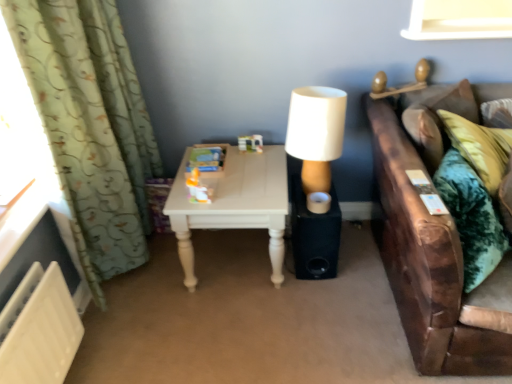
At what (x,y) coordinates should I click in order to perform the action: click on vacant area that lies between green textured curtain at left and white painted wood table at center. Please return your answer as a coordinate pair (x, y). Looking at the image, I should click on (177, 294).